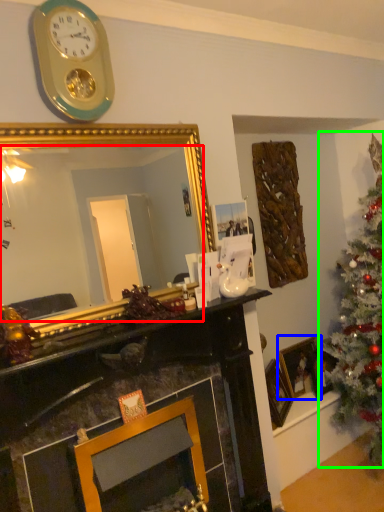
Question: Based on their relative distances, which object is nearer to mirror (highlighted by a red box)? Choose from picture frame (highlighted by a blue box) and christmas tree (highlighted by a green box).

Choices:
 (A) picture frame
 (B) christmas tree

Answer: (B)